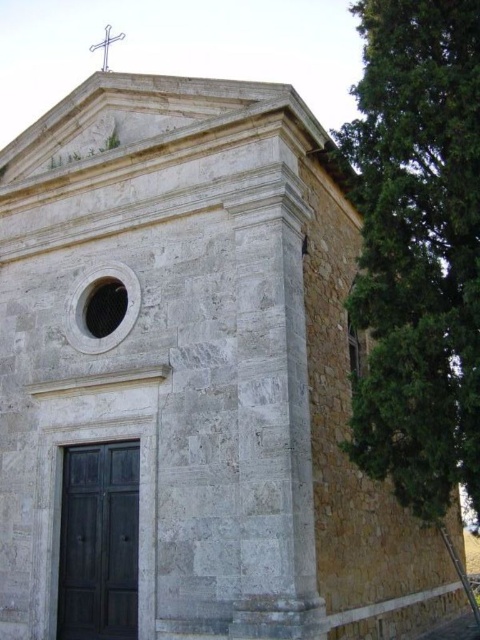
Does green textured tree at right have a lesser height compared to white wooden cross at upper center?

No, green textured tree at right is not shorter than white wooden cross at upper center.

This screenshot has width=480, height=640. What do you see at coordinates (418, 248) in the screenshot? I see `green textured tree at right` at bounding box center [418, 248].

Between point (407, 356) and point (121, 33), which one is positioned in front?

Point (407, 356) is in front.

Where is `green textured tree at right`? This screenshot has width=480, height=640. green textured tree at right is located at coordinates (418, 248).